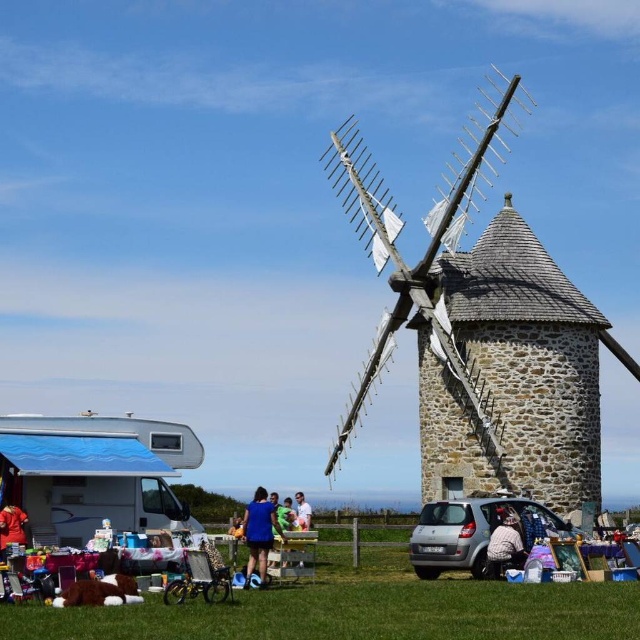
You are standing at the entrance of the market area in front of the white camper van. You need to park your silver metallic car at lower center in a spot that is closest to the windmill. Based on its current position, can you determine if it is already positioned closer to the windmill than to the camper van?

The silver metallic car at lower center is located at point (474, 531). Since the windmill is on the right side of the frame and the camper van is on the left, the car is closer to the windmill than the camper van.

You are a customer at the outdoor market and want to reach the silver metallic car at lower center parked under the red fabric dress at lower left. Can you walk directly to it without moving any items?

The silver metallic car at lower center is positioned under the red fabric dress at lower left, so you cannot walk directly to it without moving the dress first.